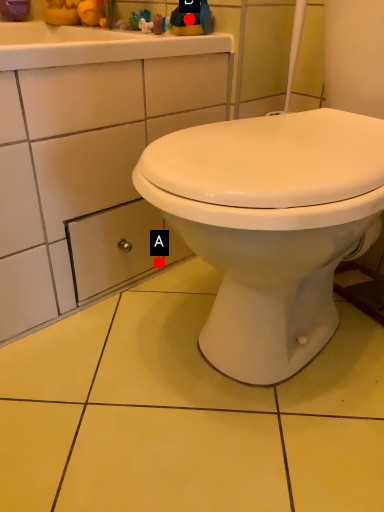
Question: Two points are circled on the image, labeled by A and B beside each circle. Among these points, which one is farthest from the camera?

Choices:
 (A) A is further
 (B) B is further

Answer: (A)